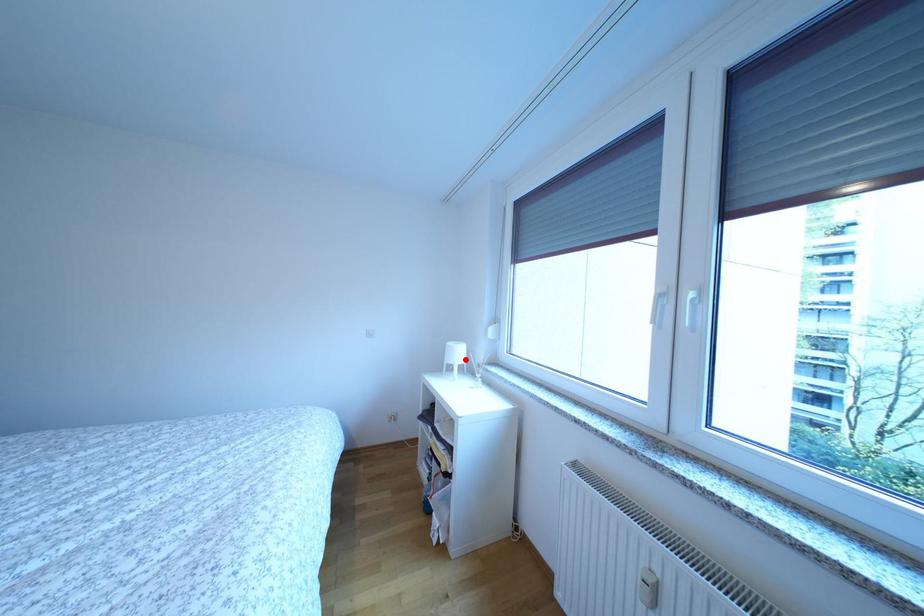
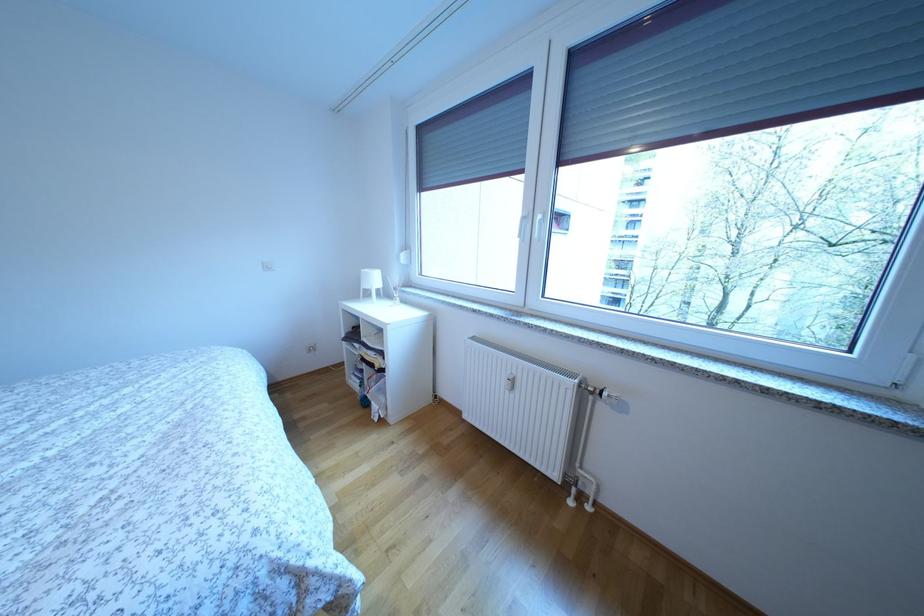
In the second image, find the point that corresponds to the highlighted location in the first image.

(382, 285)